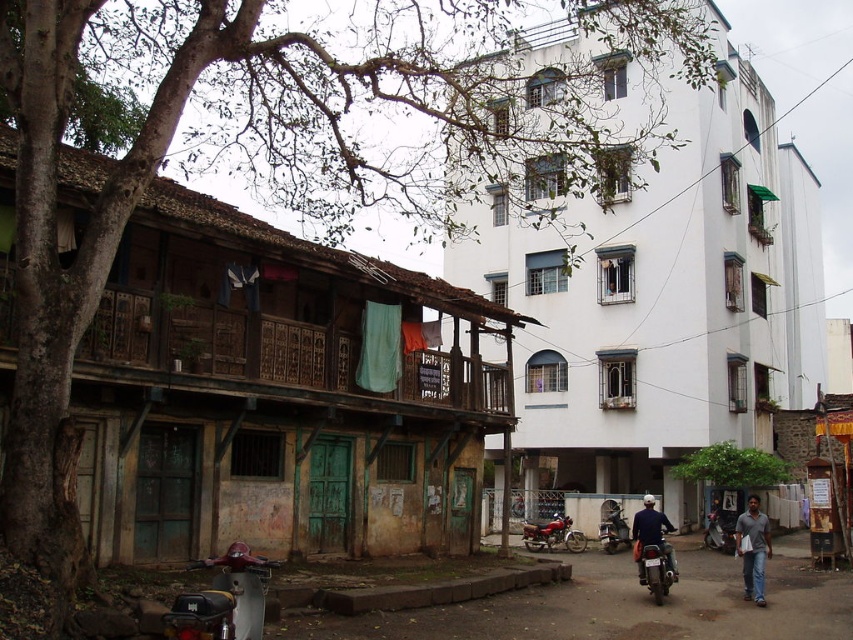
Question: Which object appears closest to the camera in this image?

Choices:
 (A) dark gray cotton shirt at lower right
 (B) shiny metallic motorcycle at lower right
 (C) metallic silver scooter at lower left
 (D) metallic silver motorcycle at center

Answer: (C)

Question: Is the position of shiny red motorcycle at center more distant than that of metallic silver motorcycle at center?

Choices:
 (A) no
 (B) yes

Answer: (B)

Question: Is dark gray cotton shirt at lower right further to the viewer compared to dark blue shirt at center?

Choices:
 (A) no
 (B) yes

Answer: (A)

Question: Which object is the farthest from the shiny red motorcycle at center?

Choices:
 (A) shiny metallic motorcycle at lower right
 (B) metallic silver scooter at lower left
 (C) dark gray cotton shirt at lower right
 (D) metallic silver motorcycle at center

Answer: (B)

Question: Estimate the real-world distances between objects in this image. Which object is closer to the metallic silver scooter at lower left?

Choices:
 (A) dark blue shirt at center
 (B) dark gray cotton shirt at lower right
 (C) shiny red motorcycle at center

Answer: (A)

Question: Does metallic silver scooter at lower left appear under dark blue shirt at center?

Choices:
 (A) yes
 (B) no

Answer: (B)